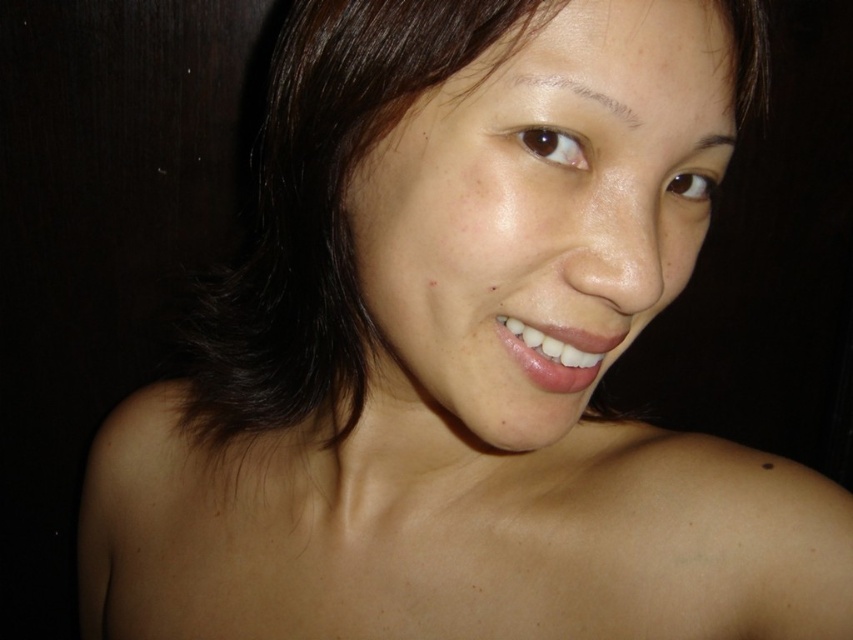
Question: Considering the real-world distances, which object is closest to the dark brown hair at upper right?

Choices:
 (A) dark brown hair at upper center
 (B) smooth skin face at center

Answer: (A)

Question: Can you confirm if dark brown hair at upper center is smaller than dark brown hair at upper right?

Choices:
 (A) no
 (B) yes

Answer: (B)

Question: Among these points, which one is nearest to the camera?

Choices:
 (A) (596, 193)
 (B) (718, 132)

Answer: (A)

Question: Which point appears closest to the camera in this image?

Choices:
 (A) (718, 131)
 (B) (517, 84)

Answer: (B)

Question: Does dark brown hair at upper center have a greater width compared to dark brown hair at upper right?

Choices:
 (A) yes
 (B) no

Answer: (A)

Question: Does smooth skin face at center appear under dark brown hair at upper right?

Choices:
 (A) yes
 (B) no

Answer: (A)